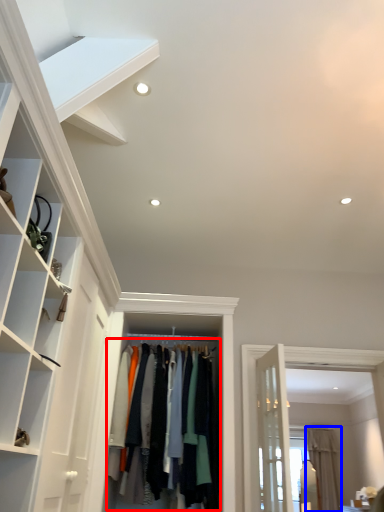
Question: Which of the following is the farthest to the observer, clothing (highlighted by a red box) or curtain (highlighted by a blue box)?

Choices:
 (A) clothing
 (B) curtain

Answer: (B)